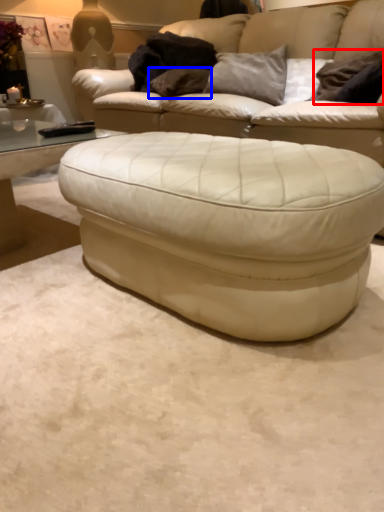
Question: Which point is further to the camera, pillow (highlighted by a red box) or pillow (highlighted by a blue box)?

Choices:
 (A) pillow
 (B) pillow

Answer: (B)